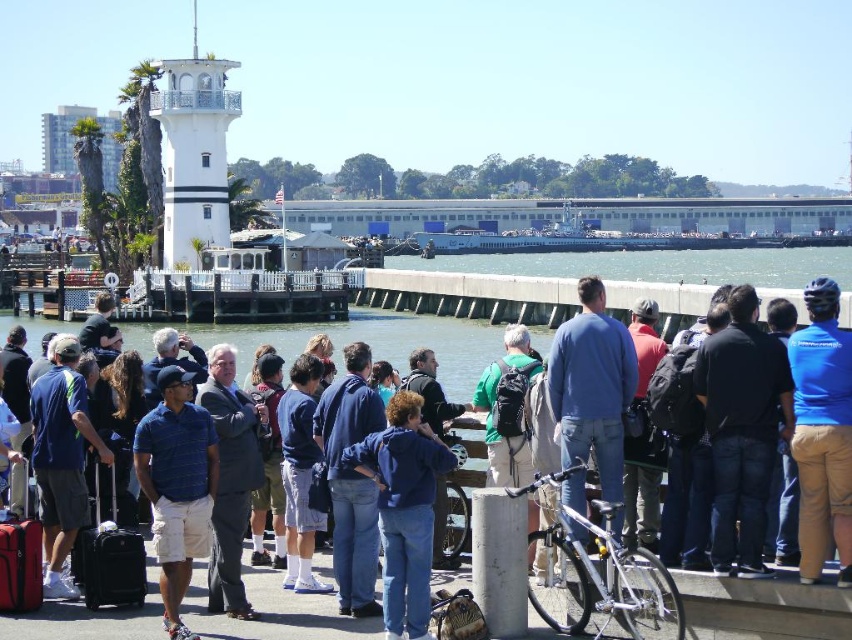
Looking at this image, you are standing at the point labeled point (439,461) and want to walk to the point labeled point (301,416). Which direction should you move to get closer to your destination?

Since point (439,461) is closer to the viewer than point (301,416), you should move backward to get closer to your destination.

You are a photographer standing at the waterfront scene. You notice a blue fabric helmet at upper right. Can you determine if the point at coordinates (822,433) is located on the blue fabric helmet?

Yes, the point at coordinates (822,433) is located on the blue fabric helmet at upper right as stated in the description.

You are a photographer trying to capture a photo of the blue denim jacket at center without the blue fabric helmet at upper right appearing in the frame. Is it possible to do so by adjusting your camera angle?

The blue fabric helmet at upper right is taller than the blue denim jacket at center, so if you lower your camera angle slightly, you can position the helmet above the frame while keeping the jacket centered, thus excluding the helmet from the shot.